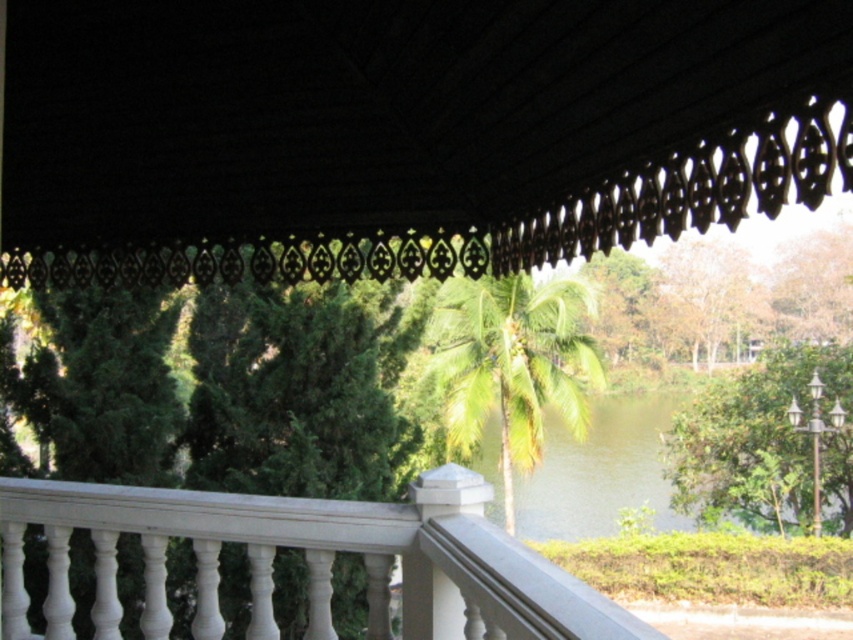
Is point (334, 292) positioned behind point (477, 417)?

No, it is not.

Does green leafy tree at center have a smaller size compared to green leafy palm at center?

Correct, green leafy tree at center occupies less space than green leafy palm at center.

Describe the element at coordinates (302, 388) in the screenshot. The width and height of the screenshot is (853, 640). I see `green leafy tree at center` at that location.

The image size is (853, 640). What are the coordinates of `green leafy tree at center` in the screenshot? It's located at (302, 388).

Which of these two, white glossy railing at center or green leafy palm at center, stands shorter?

With less height is white glossy railing at center.

Is white glossy railing at center bigger than green leafy palm at center?

Actually, white glossy railing at center might be smaller than green leafy palm at center.

Who is more distant from viewer, (480, 632) or (579, 394)?

The point (579, 394) is more distant.

You are a GUI agent. You are given a task and a screenshot of the screen. Output one action in this format:
    pyautogui.click(x=<x>, y=<y>)
    Task: Click on the white glossy railing at center
    The width and height of the screenshot is (853, 640).
    Given the screenshot: What is the action you would take?
    pyautogui.click(x=305, y=561)

Is green leafy tree at right thinner than brown textured tree at upper right?

No, green leafy tree at right is not thinner than brown textured tree at upper right.

Based on the photo, who is more forward, (834, 513) or (724, 273)?

Point (834, 513) is more forward.

Which is behind, point (727, 385) or point (669, 316)?

The point (669, 316) is more distant.

The width and height of the screenshot is (853, 640). In order to click on green leafy tree at right in this screenshot , I will do `click(764, 444)`.